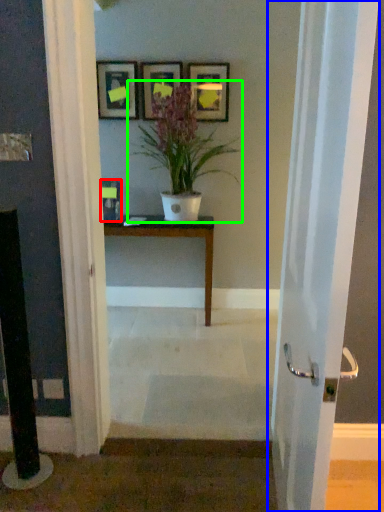
Question: Estimate the real-world distances between objects in this image. Which object is closer to picture frame (highlighted by a red box), door (highlighted by a blue box) or houseplant (highlighted by a green box)?

Choices:
 (A) door
 (B) houseplant

Answer: (B)